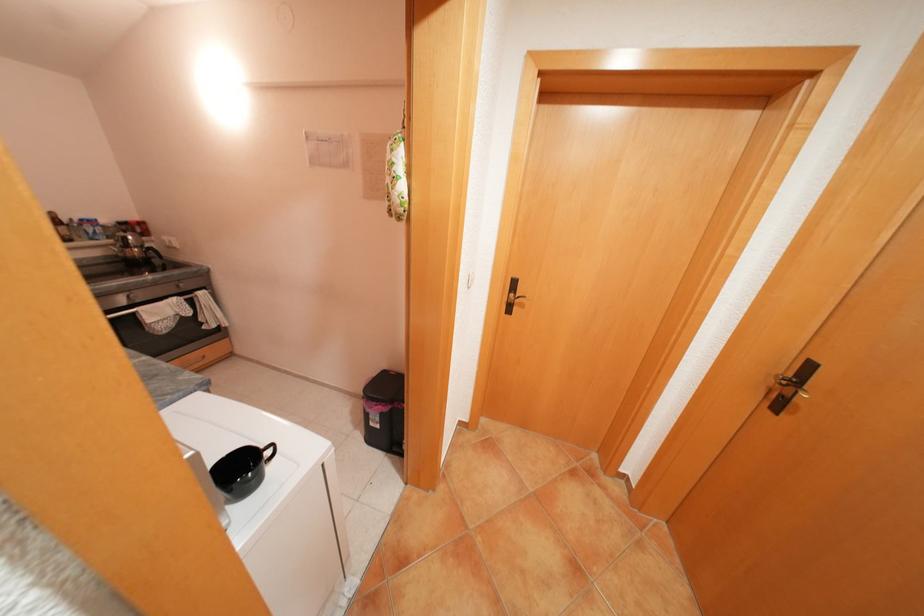
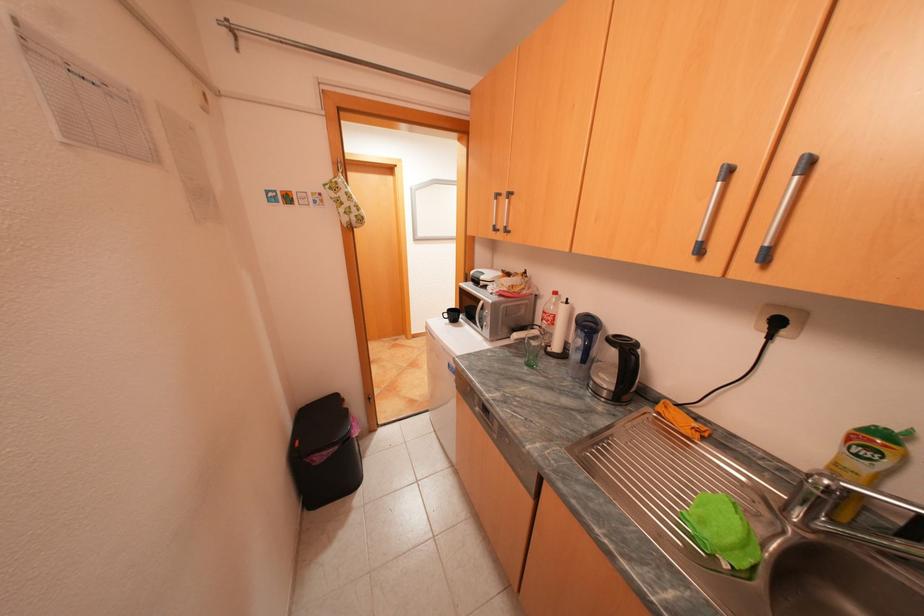
Question: I am providing you with two images of the same scene from different viewpoints. After the viewpoint changes to image2, which objects are now occluded?

Choices:
 (A) green drinking glass
 (B) black coffee mug
 (C) small cabinet handle
 (D) black mug handle

Answer: (D)